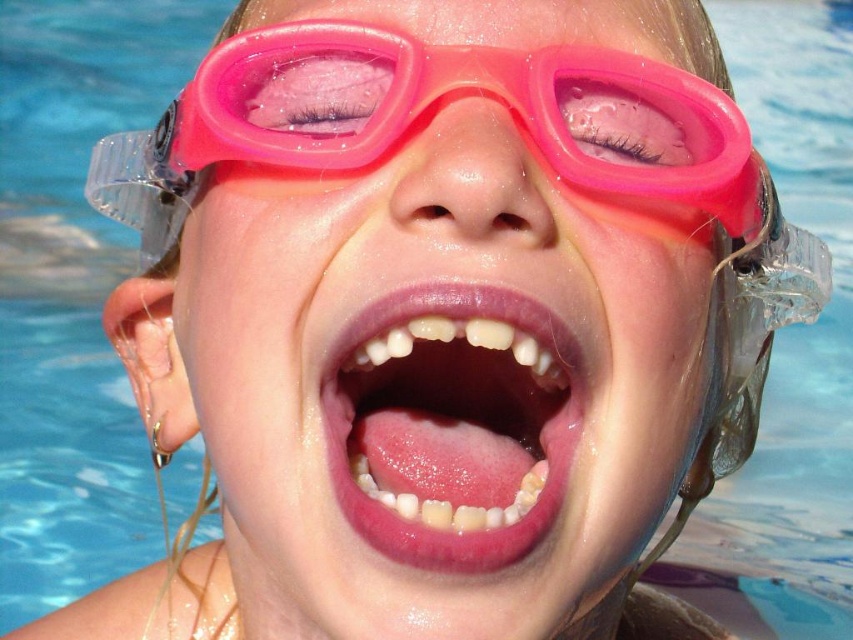
Is pink rubber goggles at center to the right of pink glossy lips at center from the viewer's perspective?

In fact, pink rubber goggles at center is to the left of pink glossy lips at center.

Locate an element on the screen. pink rubber goggles at center is located at coordinates (419, 116).